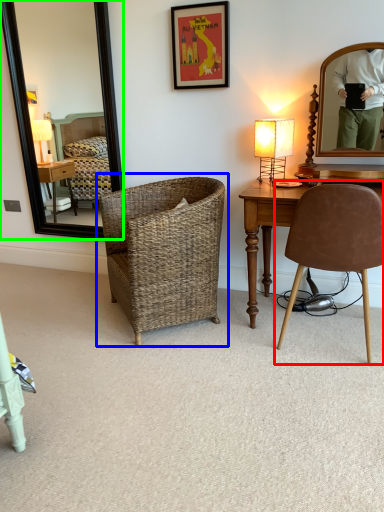
Question: Which object is the farthest from chair (highlighted by a red box)? Choose among these: chair (highlighted by a blue box) or mirror (highlighted by a green box).

Choices:
 (A) chair
 (B) mirror

Answer: (B)